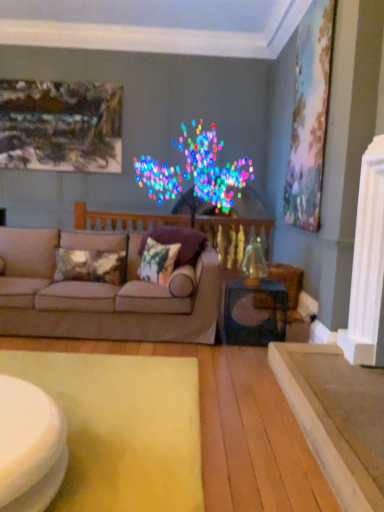
At what (x,y) coordinates should I click in order to perform the action: click on velvet floral pillow at center, the 3th pillow positioned from the left. Please return your answer as a coordinate pair (x, y). Looking at the image, I should click on (178, 242).

Describe the element at coordinates (309, 116) in the screenshot. This screenshot has height=512, width=384. I see `pastel canvas painting at upper right, positioned as the second picture frame in back-to-front order` at that location.

This screenshot has height=512, width=384. What do you see at coordinates (254, 312) in the screenshot?
I see `matte black side table at lower right` at bounding box center [254, 312].

This screenshot has height=512, width=384. What do you see at coordinates (30, 446) in the screenshot?
I see `smooth white table at lower left` at bounding box center [30, 446].

This screenshot has width=384, height=512. What do you see at coordinates (60, 126) in the screenshot?
I see `metallic silver picture frame at upper left, the 1th picture frame when ordered from left to right` at bounding box center [60, 126].

Describe the element at coordinates (157, 261) in the screenshot. I see `textured floral pillow at center, placed as the second pillow when sorted from right to left` at that location.

At what (x,y) coordinates should I click in order to perform the action: click on velvet floral pillow at center, the 3th pillow positioned from the left. Please return your answer as a coordinate pair (x, y). The image size is (384, 512). Looking at the image, I should click on (178, 242).

From a real-world perspective, is metallic silver picture frame at upper left, which ranks as the first picture frame in back-to-front order, positioned above or below beige fabric couch at center?

metallic silver picture frame at upper left, which ranks as the first picture frame in back-to-front order, is situated higher than beige fabric couch at center in the real world.

Based on the photo, is metallic silver picture frame at upper left, which ranks as the 2th picture frame in right-to-left order, placed right next to beige fabric couch at center?

No, metallic silver picture frame at upper left, which ranks as the 2th picture frame in right-to-left order, is not beside beige fabric couch at center.

Considering the sizes of objects metallic silver picture frame at upper left, which ranks as the first picture frame in back-to-front order, and beige fabric couch at center in the image provided, who is thinner, metallic silver picture frame at upper left, which ranks as the first picture frame in back-to-front order, or beige fabric couch at center?

metallic silver picture frame at upper left, which ranks as the first picture frame in back-to-front order, is thinner.

Does yellow felt mat at lower left turn towards smooth white table at lower left?

No, yellow felt mat at lower left does not turn towards smooth white table at lower left.

In the scene shown: Which point is more forward, (190, 438) or (17, 451)?

The point (17, 451) is closer to the camera.

Between yellow felt mat at lower left and smooth white table at lower left, which one is positioned in front?

Positioned in front is smooth white table at lower left.

From a real-world perspective, between textured floral pillow at center, placed as the second pillow when sorted from right to left, and yellow felt mat at lower left, who is vertically lower?

In real-world perspective, yellow felt mat at lower left is lower.

Where is `pillow that is the 2nd one above the yellow felt mat at lower left (from a real-world perspective)`? pillow that is the 2nd one above the yellow felt mat at lower left (from a real-world perspective) is located at coordinates (157, 261).

From the image's perspective, is textured floral pillow at center, placed as the second pillow when sorted from right to left, located beneath yellow felt mat at lower left?

No.

Consider the image. Is textured floral pillow at center, placed as the second pillow when sorted from right to left, turned away from yellow felt mat at lower left?

No, textured floral pillow at center, placed as the second pillow when sorted from right to left, is not facing away from yellow felt mat at lower left.

In terms of height, does beige fabric couch at center look taller or shorter compared to textured floral pillow at center, placed as the second pillow when sorted from right to left?

In the image, beige fabric couch at center appears to be taller than textured floral pillow at center, placed as the second pillow when sorted from right to left.

Considering the sizes of objects beige fabric couch at center and textured floral pillow at center, placed as the second pillow when sorted from right to left, in the image provided, who is thinner, beige fabric couch at center or textured floral pillow at center, placed as the second pillow when sorted from right to left,?

With smaller width is textured floral pillow at center, placed as the second pillow when sorted from right to left.

Which is further, (x=9, y=326) or (x=154, y=245)?

Positioned behind is point (x=154, y=245).

In the scene shown: Is beige fabric couch at center to the left of textured floral pillow at center, which appears as the 2th pillow when viewed from the left, from the viewer's perspective?

Yes.

From a real-world perspective, is metallic silver picture frame at upper left, placed as the 2th picture frame when sorted from front to back, positioned above or below matte black side table at lower right?

In terms of real-world spatial position, metallic silver picture frame at upper left, placed as the 2th picture frame when sorted from front to back, is above matte black side table at lower right.

Is metallic silver picture frame at upper left, which ranks as the first picture frame in back-to-front order, inside or outside of matte black side table at lower right?

metallic silver picture frame at upper left, which ranks as the first picture frame in back-to-front order, is not inside matte black side table at lower right, it's outside.

Is point (119, 165) closer or farther from the camera than point (276, 322)?

Point (119, 165) is positioned farther from the camera compared to point (276, 322).

Is beige fabric couch at center positioned with its back to metallic silver picture frame at upper left, placed as the 2th picture frame when sorted from front to back?

No, beige fabric couch at center is not facing away from metallic silver picture frame at upper left, placed as the 2th picture frame when sorted from front to back.

Considering the sizes of objects beige fabric couch at center and metallic silver picture frame at upper left, which ranks as the first picture frame in back-to-front order, in the image provided, who is wider, beige fabric couch at center or metallic silver picture frame at upper left, which ranks as the first picture frame in back-to-front order,?

beige fabric couch at center.

From the image's perspective, is beige fabric couch at center above or below metallic silver picture frame at upper left, placed as the 2th picture frame when sorted from front to back?

From the image's perspective, beige fabric couch at center appears below metallic silver picture frame at upper left, placed as the 2th picture frame when sorted from front to back.

From a real-world perspective, count 2nd picture frames upward from the beige fabric couch at center and point to it. Please provide its 2D coordinates.

[(60, 126)]

Is textured floral pillow at center, which appears as the 2th pillow when viewed from the left, aimed at velvet floral pillow at center, the 3th pillow positioned from the left?

No, textured floral pillow at center, which appears as the 2th pillow when viewed from the left, is not aimed at velvet floral pillow at center, the 3th pillow positioned from the left.

Can you confirm if textured floral pillow at center, placed as the second pillow when sorted from right to left, is shorter than velvet floral pillow at center, the first pillow in the right-to-left sequence?

Result: Indeed, textured floral pillow at center, placed as the second pillow when sorted from right to left, has a lesser height compared to velvet floral pillow at center, the first pillow in the right-to-left sequence.

Considering the sizes of objects textured floral pillow at center, which appears as the 2th pillow when viewed from the left, and velvet floral pillow at center, the first pillow in the right-to-left sequence, in the image provided, who is wider, textured floral pillow at center, which appears as the 2th pillow when viewed from the left, or velvet floral pillow at center, the first pillow in the right-to-left sequence,?

velvet floral pillow at center, the first pillow in the right-to-left sequence, is wider.

Where is `picture frame on the left of beige fabric couch at center`? The width and height of the screenshot is (384, 512). picture frame on the left of beige fabric couch at center is located at coordinates (60, 126).

Locate an element on the screen. Image resolution: width=384 pixels, height=512 pixels. mat below the smooth white table at lower left (from a real-world perspective) is located at coordinates [122, 428].

Based on their spatial positions, is smooth white table at lower left or wooden balustrade at center further from pastel canvas painting at upper right, the 2th picture frame when ordered from left to right?

Among the two, smooth white table at lower left is located further to pastel canvas painting at upper right, the 2th picture frame when ordered from left to right.

From the image, which object appears to be farther from pastel canvas painting at upper right, the 2th picture frame when ordered from left to right, smooth white table at lower left or metallic sheen pillow at center, marked as the first pillow in a left-to-right arrangement?

smooth white table at lower left is further to pastel canvas painting at upper right, the 2th picture frame when ordered from left to right.

When comparing their distances from pastel canvas painting at upper right, the 2th picture frame when ordered from left to right, does smooth white table at lower left or beige fabric couch at center seem further?

smooth white table at lower left is positioned further to the anchor pastel canvas painting at upper right, the 2th picture frame when ordered from left to right.

Estimate the real-world distances between objects in this image. Which object is closer to matte black side table at lower right, metallic silver picture frame at upper left, the 1th picture frame when ordered from left to right, or wooden balustrade at center?

wooden balustrade at center.

Based on their spatial positions, is wooden balustrade at center or matte black side table at lower right closer to velvet floral pillow at center, the 3th pillow positioned from the left?

Among the two, matte black side table at lower right is located nearer to velvet floral pillow at center, the 3th pillow positioned from the left.

Considering their positions, is velvet floral pillow at center, the 3th pillow positioned from the left, positioned closer to smooth white table at lower left than metallic silver picture frame at upper left, which ranks as the first picture frame in back-to-front order?

The object closer to smooth white table at lower left is velvet floral pillow at center, the 3th pillow positioned from the left.

When comparing their distances from textured floral pillow at center, placed as the second pillow when sorted from right to left, does smooth white table at lower left or matte black side table at lower right seem closer?

matte black side table at lower right.

From the image, which object appears to be farther from metallic silver picture frame at upper left, the 1th picture frame when ordered from left to right, textured floral pillow at center, which appears as the 2th pillow when viewed from the left, or beige fabric couch at center?

Among the two, textured floral pillow at center, which appears as the 2th pillow when viewed from the left, is located further to metallic silver picture frame at upper left, the 1th picture frame when ordered from left to right.

At what (x,y) coordinates should I click in order to perform the action: click on pillow between textured floral pillow at center, which appears as the 2th pillow when viewed from the left, and matte black side table at lower right. Please return your answer as a coordinate pair (x, y). The width and height of the screenshot is (384, 512). Looking at the image, I should click on (178, 242).

You are a GUI agent. You are given a task and a screenshot of the screen. Output one action in this format:
    pyautogui.click(x=<x>, y=<y>)
    Task: Click on the balustrade between metallic sheen pillow at center, which is the third pillow from right to left, and metallic silver picture frame at upper left, which ranks as the 2th picture frame in right-to-left order, in the front-back direction
    The height and width of the screenshot is (512, 384).
    Given the screenshot: What is the action you would take?
    pyautogui.click(x=234, y=234)

The width and height of the screenshot is (384, 512). In order to click on pillow between velvet floral pillow at center, the 3th pillow positioned from the left, and metallic silver picture frame at upper left, the 1th picture frame when ordered from left to right, along the z-axis in this screenshot , I will do `click(91, 266)`.

You are a GUI agent. You are given a task and a screenshot of the screen. Output one action in this format:
    pyautogui.click(x=<x>, y=<y>)
    Task: Click on the picture frame between yellow felt mat at lower left and metallic silver picture frame at upper left, which ranks as the 2th picture frame in right-to-left order, from front to back
    Image resolution: width=384 pixels, height=512 pixels.
    Given the screenshot: What is the action you would take?
    pyautogui.click(x=309, y=116)